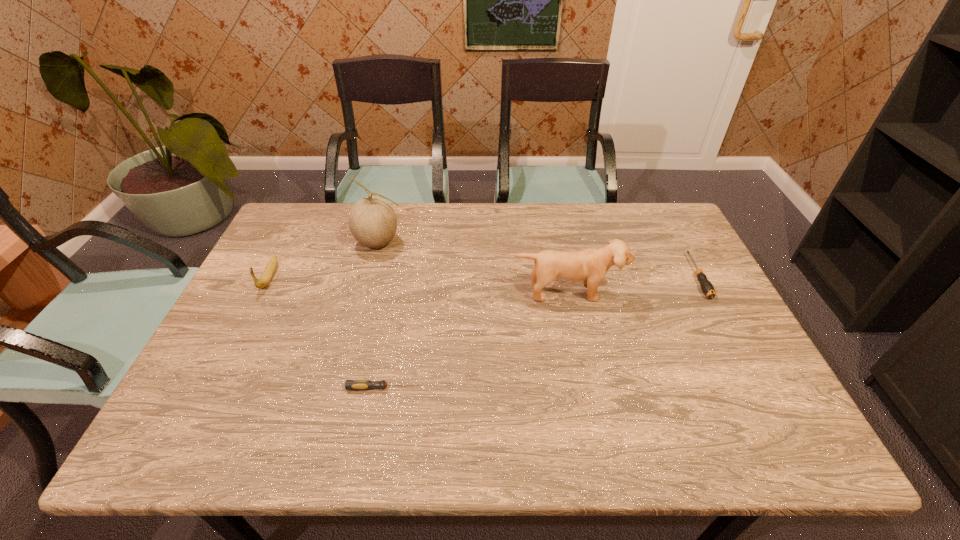
Locate an element on the screen. free space located at the stem of the leftmost object is located at coordinates click(219, 376).

The height and width of the screenshot is (540, 960). What are the coordinates of `vacant space located 0.190m on the back of the right screwdriver` in the screenshot? It's located at (667, 219).

Locate an element on the screen. vacant space situated 0.370m insert the shortest object into a screw head is located at coordinates (581, 388).

Find the location of a particular element. Image resolution: width=960 pixels, height=540 pixels. object present at the far edge is located at coordinates (372, 221).

Image resolution: width=960 pixels, height=540 pixels. What are the coordinates of `object positioned at the left edge` in the screenshot? It's located at (267, 275).

Find the location of a particular element. The height and width of the screenshot is (540, 960). object that is at the right edge is located at coordinates (707, 288).

In the image, there is a desktop. Where is `vacant space at the far edge`? vacant space at the far edge is located at coordinates (476, 221).

What are the coordinates of `vacant space at the near edge of the desktop` in the screenshot? It's located at (457, 451).

In the image, there is a desktop. Find the location of `vacant region at the left edge`. vacant region at the left edge is located at coordinates (272, 325).

Find the location of `vacant space at the right edge of the desktop`. vacant space at the right edge of the desktop is located at coordinates (662, 280).